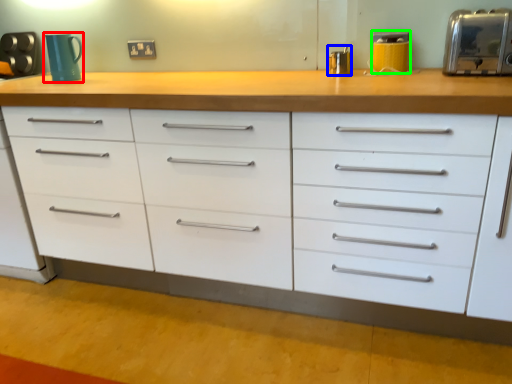
Question: Based on their relative distances, which object is farther from mug (highlighted by a red box)? Choose from appliance (highlighted by a blue box) and appliance (highlighted by a green box).

Choices:
 (A) appliance
 (B) appliance

Answer: (B)